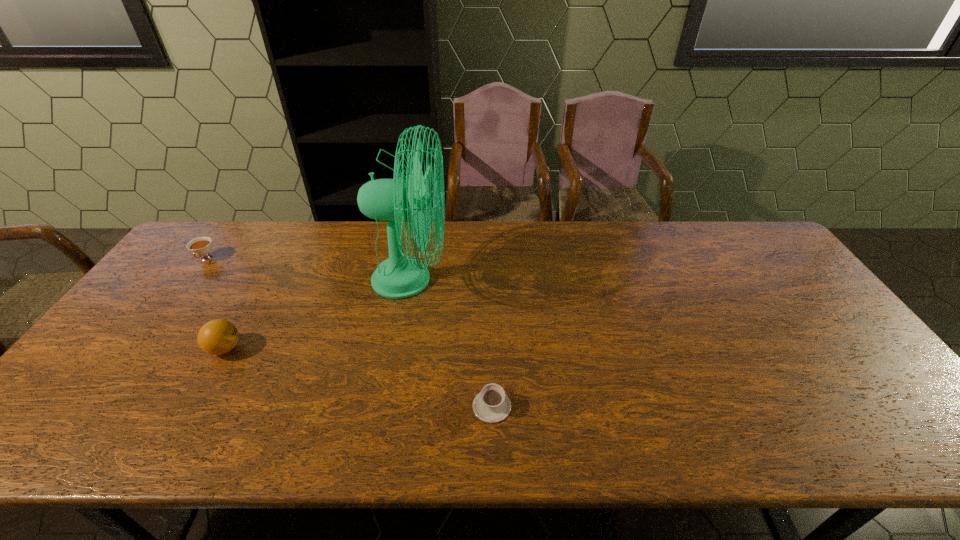
Where is `blank space that satisfies the following two spatial constraints: 1. in front of the tallest object to blow air; 2. on the handle side of the rightmost object`? This screenshot has height=540, width=960. blank space that satisfies the following two spatial constraints: 1. in front of the tallest object to blow air; 2. on the handle side of the rightmost object is located at coordinates (387, 406).

I want to click on vacant space that satisfies the following two spatial constraints: 1. on the handle side of the shorter teacup; 2. in front of the second object from right to left to blow air, so click(489, 280).